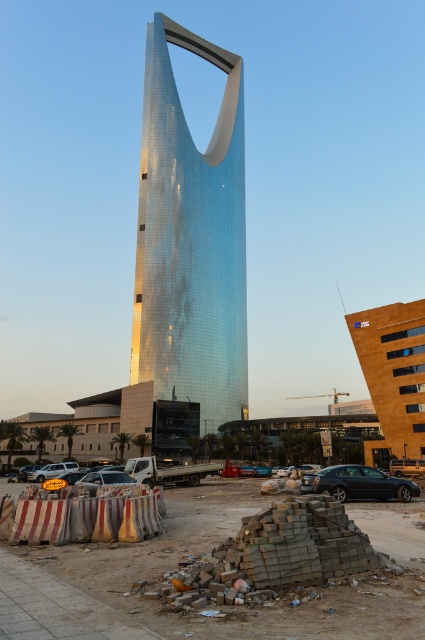
What do you see at coordinates (246, 604) in the screenshot?
I see `brick pile at lower center` at bounding box center [246, 604].

Does brick pile at lower center appear over shiny black sedan at lower right?

Yes, brick pile at lower center is above shiny black sedan at lower right.

The width and height of the screenshot is (425, 640). Describe the element at coordinates (246, 604) in the screenshot. I see `brick pile at lower center` at that location.

Where is `brick pile at lower center`? brick pile at lower center is located at coordinates (246, 604).

Who is shorter, glossy metallic tower at center or silver metallic suv at lower left?

Standing shorter between the two is silver metallic suv at lower left.

Does glossy metallic tower at center appear over silver metallic suv at lower left?

Yes.

Which is in front, point (214, 216) or point (54, 472)?

Point (54, 472) is in front.

Find the location of a particular element. glossy metallic tower at center is located at coordinates (190, 240).

You are a GUI agent. You are given a task and a screenshot of the screen. Output one action in this format:
    pyautogui.click(x=<x>, y=<y>)
    Task: Click on the brick pile at lower center
    Image resolution: width=425 pixels, height=640 pixels.
    Given the screenshot: What is the action you would take?
    point(246,604)

Can you confirm if brick pile at lower center is positioned to the right of satin silver sedan at lower left?

Yes, brick pile at lower center is to the right of satin silver sedan at lower left.

Who is more forward, (379,632) or (116,476)?

Point (379,632)

Image resolution: width=425 pixels, height=640 pixels. In order to click on brick pile at lower center in this screenshot , I will do `click(246, 604)`.